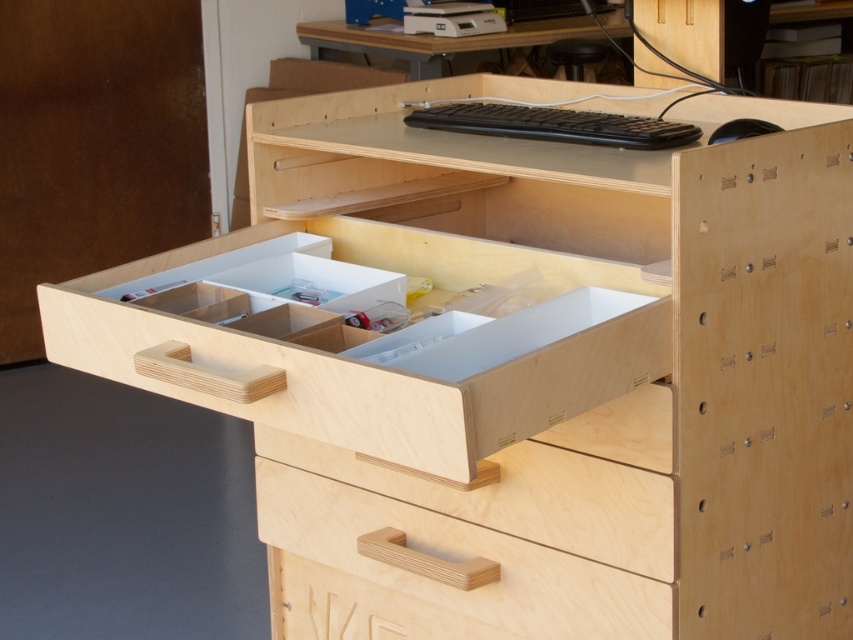
You are standing in front of the wooden desk setup and want to reach the point at coordinate point (589, 308). Can you estimate how far you need to stretch your hand to reach it?

The point at coordinate point (589, 308) is 1.32 meters away from the camera, so you need to stretch your hand approximately 1.32 meters to reach it.

You are setting up a new desk and need to place a monitor on the desk. The monitor requires a space that is not occupied by the plywood drawer at center. Where should you place the monitor?

The plywood drawer at center is located at point (x=389, y=342). To place the monitor, choose an area on the desk that does not overlap with this coordinate, such as the upper left or right side of the desk surface.

You are organizing your desk and need to move the black plastic mouse at upper right closer to you. The plywood drawer at center is in the way. Can you move the drawer to make space?

The plywood drawer at center is in front of the black plastic mouse at upper right, so you can move the drawer to create space by sliding it out or rearranging it to access the mouse.